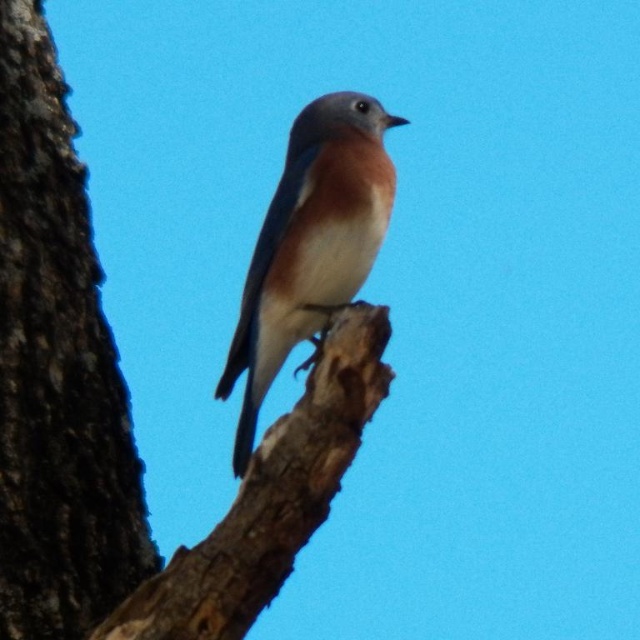
Who is positioned more to the left, dark brown rough bark at left or brown rough tree branch at center?

dark brown rough bark at left

Is dark brown rough bark at left below brown rough tree branch at center?

Actually, dark brown rough bark at left is above brown rough tree branch at center.

Is point (58, 561) positioned before point (333, 474)?

No, it is not.

In order to click on dark brown rough bark at left in this screenshot , I will do `click(56, 369)`.

Is dark brown rough bark at left further to the viewer compared to blue glossy bird at center?

No, dark brown rough bark at left is in front of blue glossy bird at center.

At what (x,y) coordinates should I click in order to perform the action: click on dark brown rough bark at left. Please return your answer as a coordinate pair (x, y). The height and width of the screenshot is (640, 640). Looking at the image, I should click on (56, 369).

Who is lower down, brown rough tree branch at center or blue glossy bird at center?

brown rough tree branch at center is below.

Is brown rough tree branch at center positioned at the back of blue glossy bird at center?

No.

At what (x,y) coordinates should I click in order to perform the action: click on brown rough tree branch at center. Please return your answer as a coordinate pair (x, y). The height and width of the screenshot is (640, 640). Looking at the image, I should click on (269, 497).